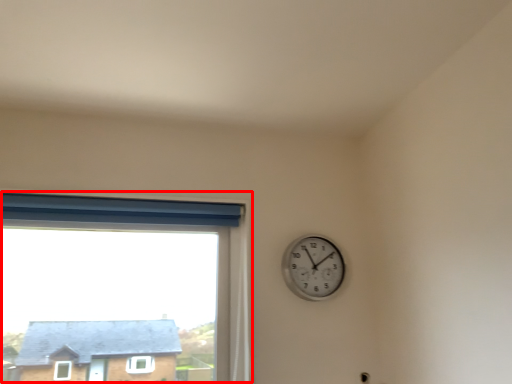
Question: From the image's perspective, where is window (annotated by the red box) located relative to wall clock?

Choices:
 (A) below
 (B) above

Answer: (A)